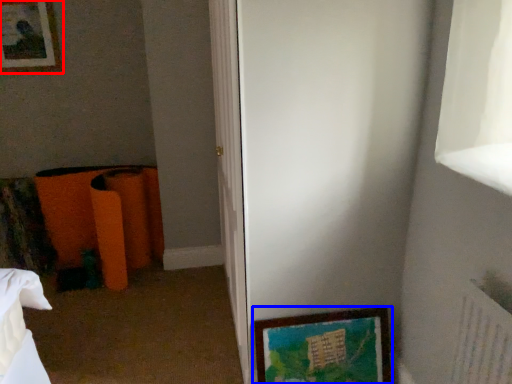
Question: Which point is closer to the camera, picture frame (highlighted by a red box) or picture frame (highlighted by a blue box)?

Choices:
 (A) picture frame
 (B) picture frame

Answer: (B)